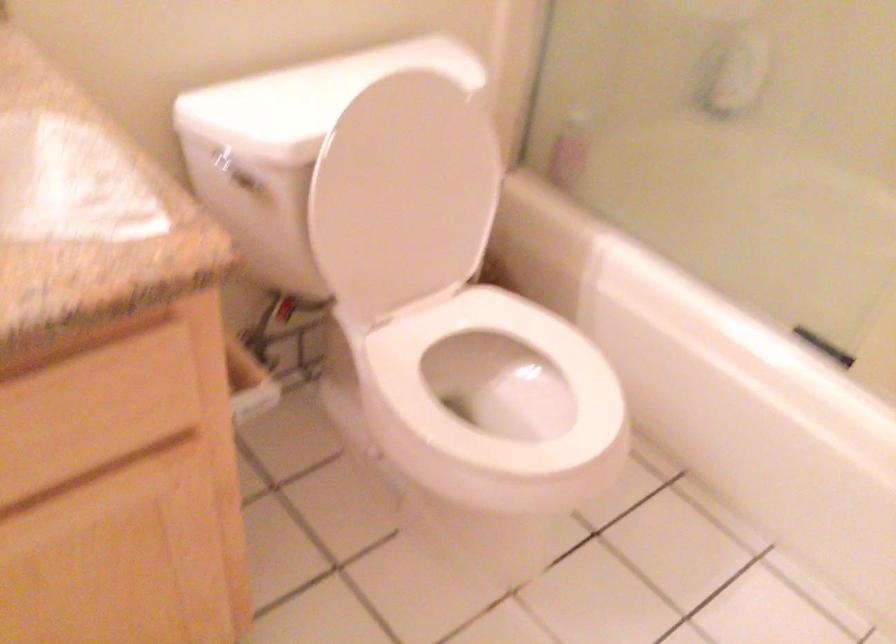
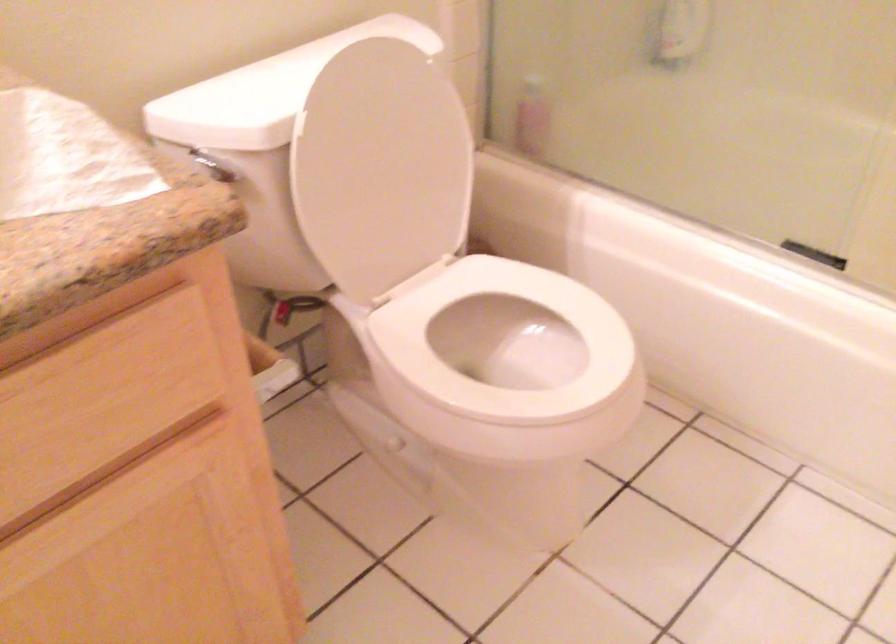
Locate, in the second image, the point that corresponds to the point at 230,164 in the first image.

(209, 164)